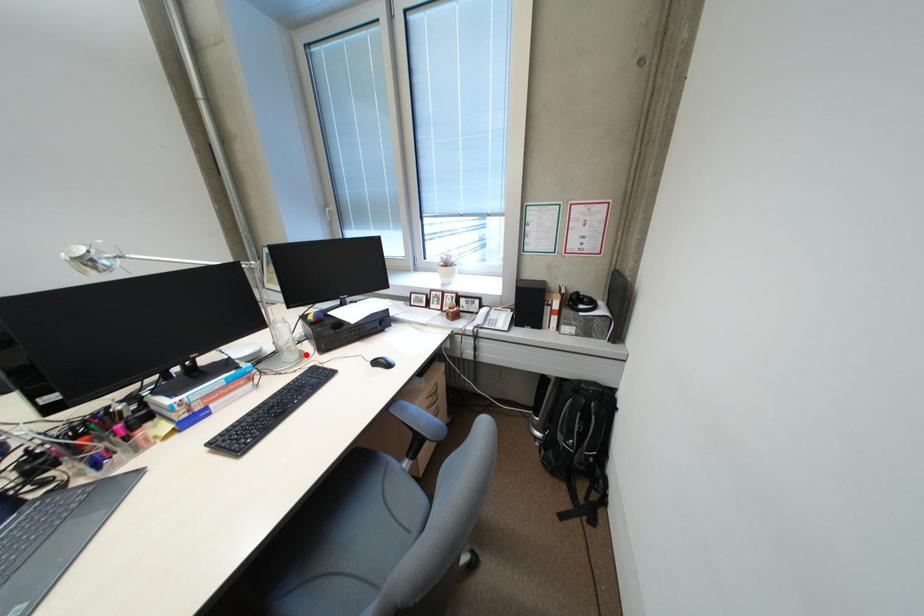
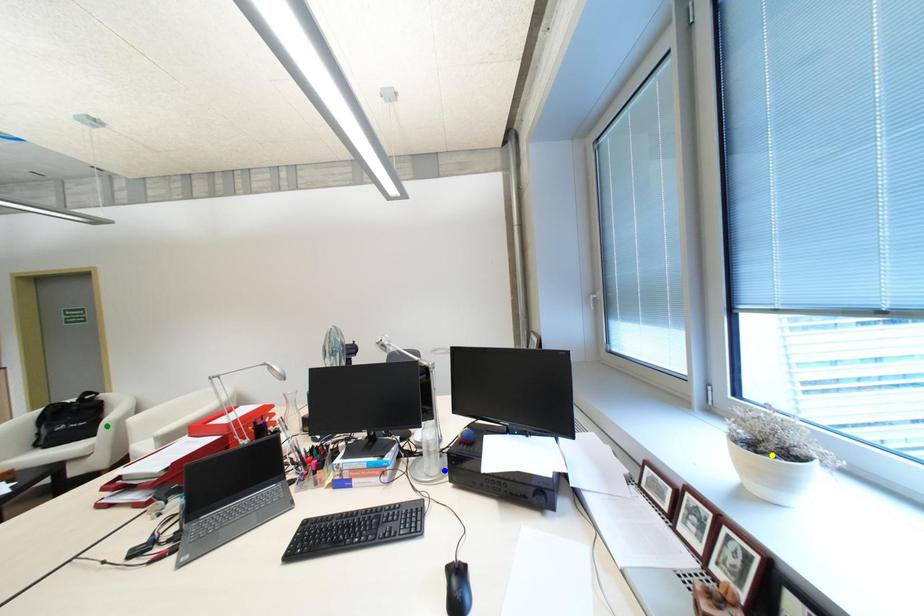
Question: I am providing you with two images of the same scene from different viewpoints. A red point is marked on the first image. You are given multiple points on the second image. Which point in image 2 is actually the same real-world point as the red point in image 1?

Choices:
 (A) yellow point
 (B) blue point
 (C) green point

Answer: (B)